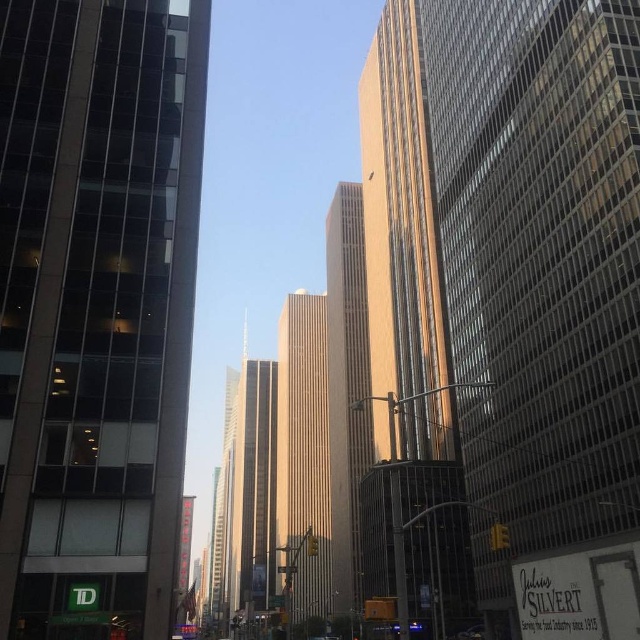
Question: Which point is closer to the camera taking this photo?

Choices:
 (A) (52, 349)
 (B) (573, 394)
 (C) (236, 544)
 (D) (298, 324)

Answer: (A)

Question: Is the position of gold reflective glass skyscraper at center less distant than that of sandy beige concrete tower at center?

Choices:
 (A) yes
 (B) no

Answer: (A)

Question: Is gold textured building at center smaller than shiny glass skyscraper at center?

Choices:
 (A) yes
 (B) no

Answer: (A)

Question: Among these objects, which one is nearest to the camera?

Choices:
 (A) glassy reflective building at left
 (B) gold textured building at center
 (C) shiny glass skyscraper at center
 (D) sandy beige concrete tower at center

Answer: (A)

Question: Which point is farther to the camera?

Choices:
 (A) [x=179, y=435]
 (B) [x=253, y=385]
 (C) [x=337, y=285]

Answer: (B)

Question: Observing the image, what is the correct spatial positioning of gold reflective glass skyscraper at center in reference to sandy beige concrete tower at center?

Choices:
 (A) right
 (B) left

Answer: (A)